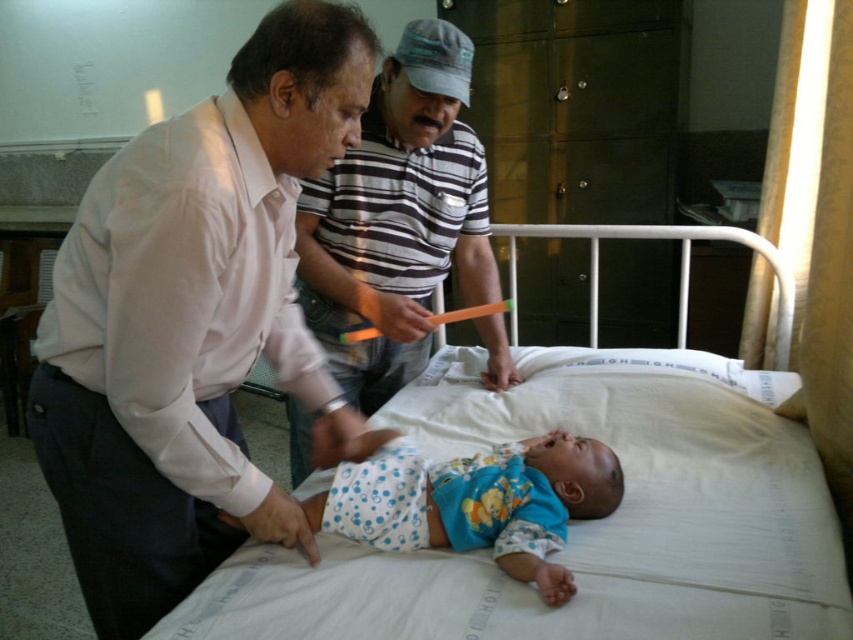
You are a medical student observing the scene. You need to determine which object is nearer to you between the white fabric bed at center and the striped cotton shirt at center. Which one is closer?

The white fabric bed at center is closer to the viewer than the striped cotton shirt at center.